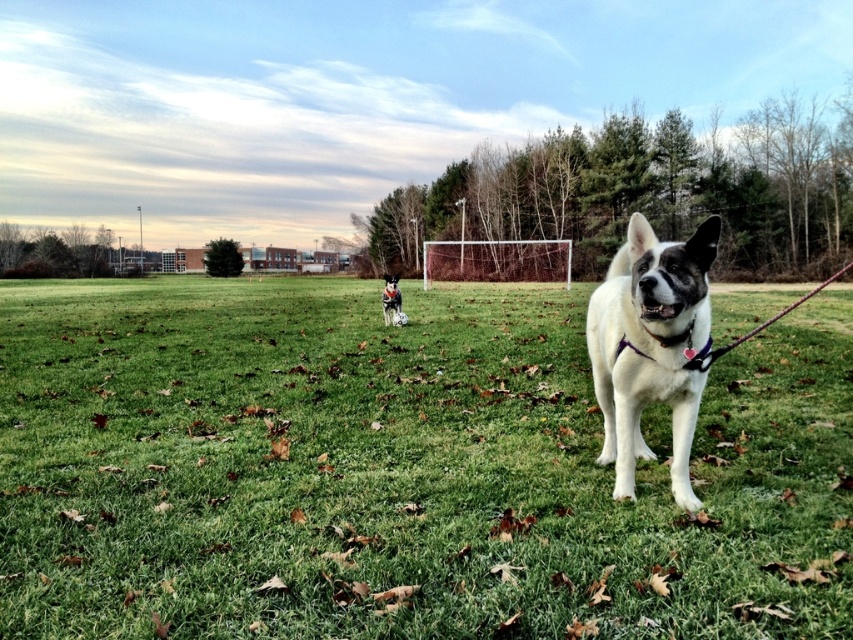
Question: Which object is the closest to the white fur dog at center?

Choices:
 (A) black and white fur at center
 (B) green grass at center

Answer: (B)

Question: Which point is closer to the camera taking this photo?

Choices:
 (A) (126, 628)
 (B) (663, 378)

Answer: (A)

Question: Can you confirm if green grass at center is positioned below white fur dog at center?

Choices:
 (A) yes
 (B) no

Answer: (B)

Question: Which point is closer to the camera?

Choices:
 (A) green grass at center
 (B) black and white fur at center
 (C) white fur dog at center

Answer: (A)

Question: Is green grass at center to the left of white fur dog at center from the viewer's perspective?

Choices:
 (A) no
 (B) yes

Answer: (A)

Question: Is green grass at center below black and white fur at center?

Choices:
 (A) no
 (B) yes

Answer: (B)